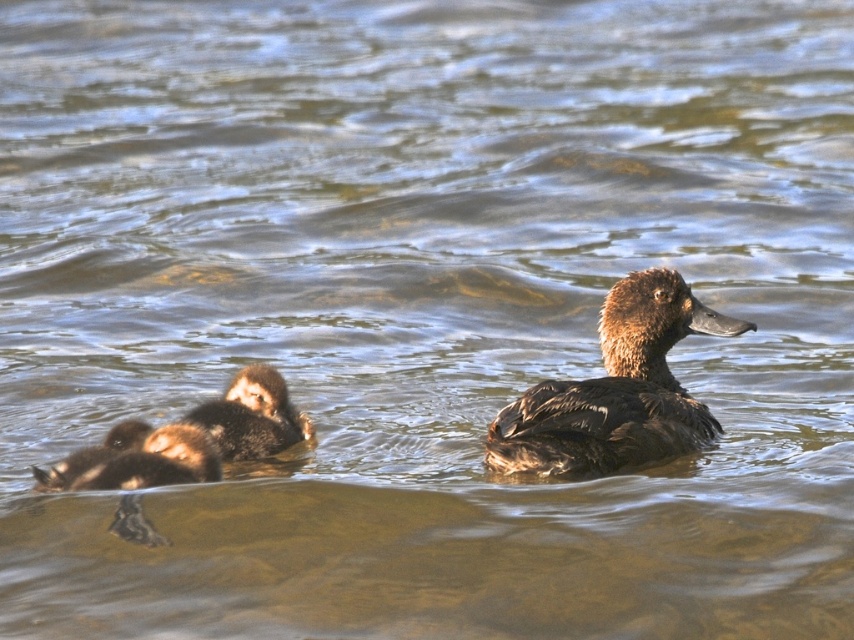
Does point (630, 422) lie in front of point (278, 444)?

That is True.

Can you confirm if brown matte duck at center is positioned above brown fuzzy duckling at lower left?

Yes.

Image resolution: width=854 pixels, height=640 pixels. What are the coordinates of `brown matte duck at center` in the screenshot? It's located at (616, 388).

Which of these two, dark brown fluffy duckling at lower left or brown fuzzy duckling at lower left, stands shorter?

Standing shorter between the two is dark brown fluffy duckling at lower left.

Between dark brown fluffy duckling at lower left and brown fuzzy duckling at lower left, which one appears on the left side from the viewer's perspective?

From the viewer's perspective, dark brown fluffy duckling at lower left appears more on the left side.

Identify the location of dark brown fluffy duckling at lower left. This screenshot has width=854, height=640. (137, 460).

Which is behind, point (642, 396) or point (88, 451)?

The point (642, 396) is behind.

Does point (519, 461) come closer to viewer compared to point (92, 484)?

No, it is not.

Where is `brown matte duck at center`? This screenshot has width=854, height=640. brown matte duck at center is located at coordinates (616, 388).